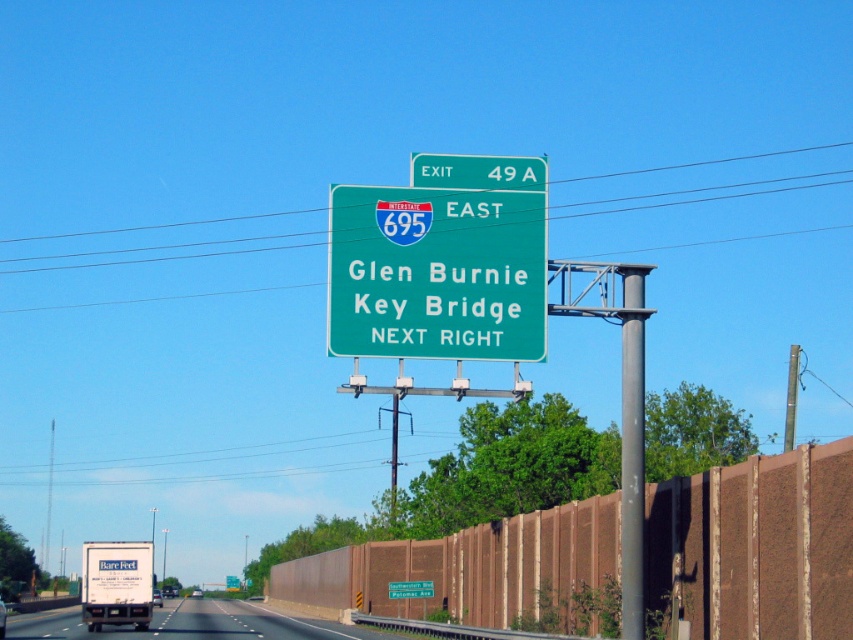
You are driving on the highway and see the green highway sign and the brown noise barrier wall. There are two points marked on your GPS navigation screen at coordinates point (634, 314) and point (517, 157). According to the scene description, which point is closer to you as you drive along the highway?

Point (634, 314) is in front of point (517, 157), so the point closer to you while driving would be point (634, 314).